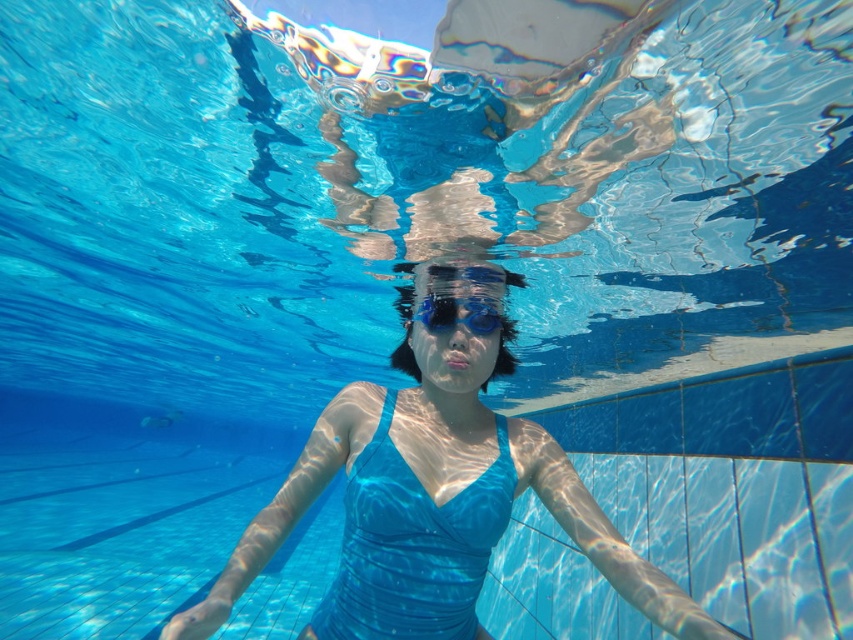
Does blue matte swimsuit at center have a lesser width compared to matte blue swimsuit at center?

No, blue matte swimsuit at center is not thinner than matte blue swimsuit at center.

This screenshot has height=640, width=853. Identify the location of blue matte swimsuit at center. (508, 442).

Is matte blue swimsuit at center bigger than blue matte goggles at center?

Indeed, matte blue swimsuit at center has a larger size compared to blue matte goggles at center.

Is point (370, 540) positioned in front of point (440, 307)?

That is True.

Describe the element at coordinates (412, 547) in the screenshot. The width and height of the screenshot is (853, 640). I see `matte blue swimsuit at center` at that location.

Locate an element on the screen. This screenshot has width=853, height=640. matte blue swimsuit at center is located at coordinates (412, 547).

Does blue matte swimsuit at center have a smaller size compared to blue matte goggles at center?

Actually, blue matte swimsuit at center might be larger than blue matte goggles at center.

Which is in front, point (206, 630) or point (433, 317)?

Point (206, 630)

Locate an element on the screen. This screenshot has height=640, width=853. blue matte swimsuit at center is located at coordinates (508, 442).